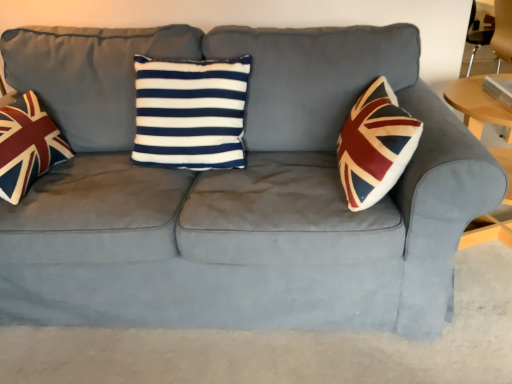
Question: Is wooden round table at right at the back of navy blue/white striped cushion at center?

Choices:
 (A) yes
 (B) no

Answer: (B)

Question: Considering the relative positions of navy blue/white striped cushion at center and wooden round table at right in the image provided, is navy blue/white striped cushion at center to the left of wooden round table at right from the viewer's perspective?

Choices:
 (A) no
 (B) yes

Answer: (B)

Question: From a real-world perspective, is navy blue/white striped cushion at center located higher than wooden round table at right?

Choices:
 (A) no
 (B) yes

Answer: (B)

Question: Could wooden round table at right be considered to be inside navy blue/white striped cushion at center?

Choices:
 (A) no
 (B) yes

Answer: (A)

Question: Does navy blue/white striped cushion at center lie behind wooden round table at right?

Choices:
 (A) yes
 (B) no

Answer: (A)

Question: In terms of width, does union jack fabric pillow at left look wider or thinner when compared to wooden round table at right?

Choices:
 (A) thin
 (B) wide

Answer: (A)

Question: Is point (23, 147) closer or farther from the camera than point (503, 76)?

Choices:
 (A) closer
 (B) farther

Answer: (A)

Question: Considering the relative positions of union jack fabric pillow at left and wooden round table at right in the image provided, is union jack fabric pillow at left to the left or to the right of wooden round table at right?

Choices:
 (A) right
 (B) left

Answer: (B)

Question: Considering the positions of union jack fabric pillow at left and wooden round table at right in the image, is union jack fabric pillow at left taller or shorter than wooden round table at right?

Choices:
 (A) short
 (B) tall

Answer: (A)

Question: From a real-world perspective, is navy blue/white striped cushion at center above or below wooden round table at right?

Choices:
 (A) above
 (B) below

Answer: (A)

Question: Considering their positions, is navy blue/white striped cushion at center located in front of or behind wooden round table at right?

Choices:
 (A) behind
 (B) front

Answer: (A)

Question: Visually, is navy blue/white striped cushion at center positioned to the left or to the right of wooden round table at right?

Choices:
 (A) right
 (B) left

Answer: (B)

Question: Is navy blue/white striped cushion at center wider or thinner than wooden round table at right?

Choices:
 (A) wide
 (B) thin

Answer: (B)

Question: In the image, is wooden round table at right positioned in front of or behind union jack fabric pillow at left?

Choices:
 (A) front
 (B) behind

Answer: (B)

Question: Considering the positions of point (498, 233) and point (31, 119), is point (498, 233) closer or farther from the camera than point (31, 119)?

Choices:
 (A) farther
 (B) closer

Answer: (A)